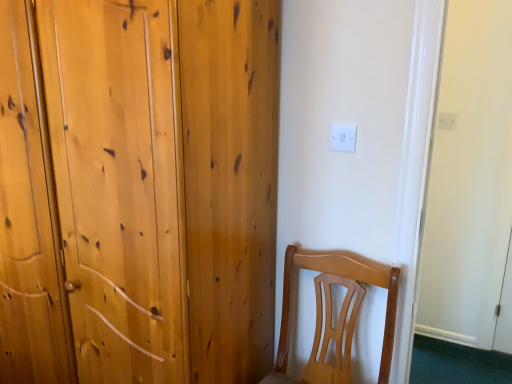
Measure the distance between white plastic electric outlet at upper center, the first electric outlet from the front, and camera.

white plastic electric outlet at upper center, the first electric outlet from the front, and camera are 1.40 meters apart.

The height and width of the screenshot is (384, 512). Find the location of `white plastic electric outlet at upper center, the first electric outlet from the front`. white plastic electric outlet at upper center, the first electric outlet from the front is located at coordinates (343, 138).

Which object is closer to the camera, white plastic electric outlet at upper center, arranged as the second electric outlet when viewed from the back, or natural wood wardrobe at left?

natural wood wardrobe at left.

Measure the distance from white plastic electric outlet at upper center, which is the second electric outlet in top-to-bottom order, to natural wood wardrobe at left.

white plastic electric outlet at upper center, which is the second electric outlet in top-to-bottom order, is 30.26 inches from natural wood wardrobe at left.

From a real-world perspective, is white plastic electric outlet at upper center, which appears as the 1th electric outlet when viewed from the left, positioned over natural wood wardrobe at left based on gravity?

Correct, in the physical world, white plastic electric outlet at upper center, which appears as the 1th electric outlet when viewed from the left, is higher than natural wood wardrobe at left.

Looking at this image, based on their positions, is white plastic electric outlet at upper center, the 1th electric outlet when ordered from bottom to top, located to the left or right of natural wood wardrobe at left?

white plastic electric outlet at upper center, the 1th electric outlet when ordered from bottom to top, is to the right of natural wood wardrobe at left.

Who is more distant, natural wood wardrobe at left or white plastic electric outlet at upper center, which appears as the 1th electric outlet when viewed from the left?

white plastic electric outlet at upper center, which appears as the 1th electric outlet when viewed from the left, is further from the camera.

Would you say natural wood wardrobe at left is to the left or to the right of white plastic electric outlet at upper center, which appears as the 1th electric outlet when viewed from the left, in the picture?

From the image, it's evident that natural wood wardrobe at left is to the left of white plastic electric outlet at upper center, which appears as the 1th electric outlet when viewed from the left.

From the picture: From a real-world perspective, is natural wood wardrobe at left located higher than white plastic electric outlet at upper center, the second electric outlet in the right-to-left sequence?

No.

Looking at this image, which is closer, (13, 284) or (345, 142)?

Clearly, point (13, 284) is more distant from the camera than point (345, 142).

Are white plastic electric outlet at upper right, which appears as the 1th electric outlet when viewed from the top, and light brown wood chair at lower right far apart?

Indeed, white plastic electric outlet at upper right, which appears as the 1th electric outlet when viewed from the top, is not near light brown wood chair at lower right.

How many degrees apart are the facing directions of white plastic electric outlet at upper right, positioned as the second electric outlet in front-to-back order, and light brown wood chair at lower right?

2.24 degrees.

Does point (440, 124) appear closer or farther from the camera than point (295, 267)?

Point (440, 124) appears to be farther away from the viewer than point (295, 267).

From the image's perspective, is white plastic electric outlet at upper right, which appears as the 1th electric outlet when viewed from the top, positioned above or below light brown wood chair at lower right?

white plastic electric outlet at upper right, which appears as the 1th electric outlet when viewed from the top, is situated higher than light brown wood chair at lower right in the image.

Identify the location of chair below the white plastic electric outlet at upper right, placed as the second electric outlet when sorted from bottom to top (from the image's perspective). This screenshot has height=384, width=512. (345, 277).

From a real-world perspective, is light brown wood chair at lower right physically located above or below white plastic electric outlet at upper right, which appears as the 1th electric outlet when viewed from the top?

From a real-world perspective, light brown wood chair at lower right is physically below white plastic electric outlet at upper right, which appears as the 1th electric outlet when viewed from the top.

Is light brown wood chair at lower right at the left side of white plastic electric outlet at upper right, the 2th electric outlet viewed from the left?

Yes.

Considering the sizes of light brown wood chair at lower right and white plastic electric outlet at upper right, which appears as the 1th electric outlet when viewed from the top, in the image, is light brown wood chair at lower right taller or shorter than white plastic electric outlet at upper right, which appears as the 1th electric outlet when viewed from the top,?

In the image, light brown wood chair at lower right appears to be taller than white plastic electric outlet at upper right, which appears as the 1th electric outlet when viewed from the top.

Is white plastic electric outlet at upper right, positioned as the second electric outlet in front-to-back order, facing away from white plastic electric outlet at upper center, which is the second electric outlet in top-to-bottom order?

That's not correct — white plastic electric outlet at upper right, positioned as the second electric outlet in front-to-back order, is not looking away from white plastic electric outlet at upper center, which is the second electric outlet in top-to-bottom order.

From the image's perspective, which one is positioned lower, white plastic electric outlet at upper right, which appears as the 1th electric outlet when viewed from the top, or white plastic electric outlet at upper center, the second electric outlet in the right-to-left sequence?

white plastic electric outlet at upper center, the second electric outlet in the right-to-left sequence, is shown below in the image.

Can you tell me how much natural wood wardrobe at left and white plastic electric outlet at upper right, positioned as the second electric outlet in front-to-back order, differ in facing direction?

The angle between the facing direction of natural wood wardrobe at left and the facing direction of white plastic electric outlet at upper right, positioned as the second electric outlet in front-to-back order, is 1.39 degrees.

In the image, is natural wood wardrobe at left positioned in front of or behind white plastic electric outlet at upper right, the 2th electric outlet viewed from the left?

natural wood wardrobe at left is in front of white plastic electric outlet at upper right, the 2th electric outlet viewed from the left.

Is natural wood wardrobe at left positioned far away from white plastic electric outlet at upper right, which appears as the 1th electric outlet when viewed from the top?

Yes.

Considering the relative sizes of natural wood wardrobe at left and white plastic electric outlet at upper right, placed as the second electric outlet when sorted from bottom to top, in the image provided, is natural wood wardrobe at left smaller than white plastic electric outlet at upper right, placed as the second electric outlet when sorted from bottom to top,?

Incorrect, natural wood wardrobe at left is not smaller in size than white plastic electric outlet at upper right, placed as the second electric outlet when sorted from bottom to top.

From the image's perspective, which one is positioned higher, light brown wood chair at lower right or white plastic electric outlet at upper center, the 1th electric outlet when ordered from bottom to top?

white plastic electric outlet at upper center, the 1th electric outlet when ordered from bottom to top.

From a real-world perspective, is light brown wood chair at lower right above or below white plastic electric outlet at upper center, which is the second electric outlet in top-to-bottom order?

light brown wood chair at lower right is situated lower than white plastic electric outlet at upper center, which is the second electric outlet in top-to-bottom order, in the real world.

Which is closer to the camera, (339, 268) or (345, 140)?

Positioned in front is point (345, 140).

Based on the photo, can you tell me how much light brown wood chair at lower right and white plastic electric outlet at upper center, the second electric outlet in the right-to-left sequence, differ in facing direction?

1.49 degrees separate the facing orientations of light brown wood chair at lower right and white plastic electric outlet at upper center, the second electric outlet in the right-to-left sequence.

You are a GUI agent. You are given a task and a screenshot of the screen. Output one action in this format:
    pyautogui.click(x=<x>, y=<y>)
    Task: Click on the 1st electric outlet behind the natural wood wardrobe at left
    The width and height of the screenshot is (512, 384).
    Given the screenshot: What is the action you would take?
    pyautogui.click(x=343, y=138)

This screenshot has width=512, height=384. I want to click on door located in front of the white plastic electric outlet at upper center, arranged as the second electric outlet when viewed from the back, so click(138, 190).

Looking at this image, looking at the image, which one is located further to light brown wood chair at lower right, white plastic electric outlet at upper right, the 2th electric outlet viewed from the left, or white plastic electric outlet at upper center, the second electric outlet in the right-to-left sequence?

white plastic electric outlet at upper right, the 2th electric outlet viewed from the left, is positioned further to the anchor light brown wood chair at lower right.

When comparing their distances from light brown wood chair at lower right, does white plastic electric outlet at upper center, which appears as the 1th electric outlet when viewed from the left, or white plastic electric outlet at upper right, which is the first electric outlet from back to front, seem closer?

Based on the image, white plastic electric outlet at upper center, which appears as the 1th electric outlet when viewed from the left, appears to be nearer to light brown wood chair at lower right.

Which object lies further to the anchor point natural wood wardrobe at left, light brown wood chair at lower right or white plastic electric outlet at upper center, arranged as the second electric outlet when viewed from the back?

The object further to natural wood wardrobe at left is white plastic electric outlet at upper center, arranged as the second electric outlet when viewed from the back.

Which object lies further to the anchor point light brown wood chair at lower right, white plastic electric outlet at upper center, which is the second electric outlet in top-to-bottom order, or natural wood wardrobe at left?

natural wood wardrobe at left is positioned further to the anchor light brown wood chair at lower right.

Based on their spatial positions, is natural wood wardrobe at left or white plastic electric outlet at upper center, which is the second electric outlet in top-to-bottom order, closer to white plastic electric outlet at upper right, the 2th electric outlet viewed from the left?

white plastic electric outlet at upper center, which is the second electric outlet in top-to-bottom order.

Looking at the image, which one is located closer to light brown wood chair at lower right, natural wood wardrobe at left or white plastic electric outlet at upper right, which is the first electric outlet from back to front?

natural wood wardrobe at left.

When comparing their distances from light brown wood chair at lower right, does white plastic electric outlet at upper right, the 2th electric outlet viewed from the left, or natural wood wardrobe at left seem further?

Among the two, white plastic electric outlet at upper right, the 2th electric outlet viewed from the left, is located further to light brown wood chair at lower right.

When comparing their distances from natural wood wardrobe at left, does white plastic electric outlet at upper center, the second electric outlet in the right-to-left sequence, or white plastic electric outlet at upper right, the 2th electric outlet viewed from the left, seem closer?

Based on the image, white plastic electric outlet at upper center, the second electric outlet in the right-to-left sequence, appears to be nearer to natural wood wardrobe at left.

The height and width of the screenshot is (384, 512). I want to click on chair between natural wood wardrobe at left and white plastic electric outlet at upper center, which appears as the 1th electric outlet when viewed from the left, so click(x=345, y=277).

Locate an element on the screen. chair located between natural wood wardrobe at left and white plastic electric outlet at upper right, positioned as the 1th electric outlet in right-to-left order, in the left-right direction is located at coordinates [x=345, y=277].

The height and width of the screenshot is (384, 512). I want to click on electric outlet between light brown wood chair at lower right and white plastic electric outlet at upper right, positioned as the 1th electric outlet in right-to-left order, in the front-back direction, so click(x=343, y=138).

Where is `electric outlet between natural wood wardrobe at left and white plastic electric outlet at upper right, placed as the second electric outlet when sorted from bottom to top, in the horizontal direction`? Image resolution: width=512 pixels, height=384 pixels. electric outlet between natural wood wardrobe at left and white plastic electric outlet at upper right, placed as the second electric outlet when sorted from bottom to top, in the horizontal direction is located at coordinates (343, 138).